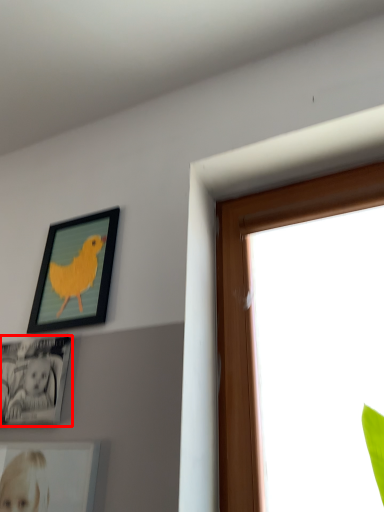
Question: Observing the image, what is the correct spatial positioning of picture frame (annotated by the red box) in reference to picture frame?

Choices:
 (A) right
 (B) left

Answer: (B)